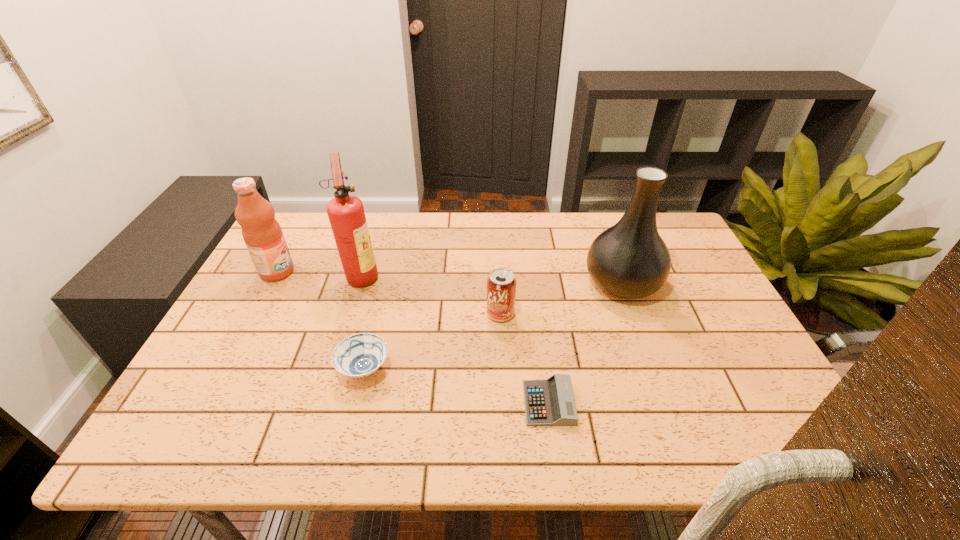
Find the location of a particular element. The image size is (960, 540). vacant space at the right edge of the desktop is located at coordinates (692, 282).

Find the location of a particular element. blank space at the far left corner of the desktop is located at coordinates (326, 219).

I want to click on vacant space at the far right corner, so click(x=676, y=230).

The image size is (960, 540). In the image, there is a desktop. In order to click on free space at the near right corner in this screenshot , I will do `click(758, 449)`.

Where is `free area in between the fire extinguisher and the shortest object`? The image size is (960, 540). free area in between the fire extinguisher and the shortest object is located at coordinates (455, 339).

Locate an element on the screen. empty location between the leftmost object and the vase is located at coordinates (449, 277).

Locate an element on the screen. free point between the calculator and the fifth tallest object is located at coordinates (456, 386).

Identify the location of vacant area that lies between the rightmost object and the third shortest object. (562, 298).

Identify the location of vacant area that lies between the fire extinguisher and the soda can. (431, 294).

The width and height of the screenshot is (960, 540). I want to click on free space that is in between the vase and the second shortest object, so (x=493, y=326).